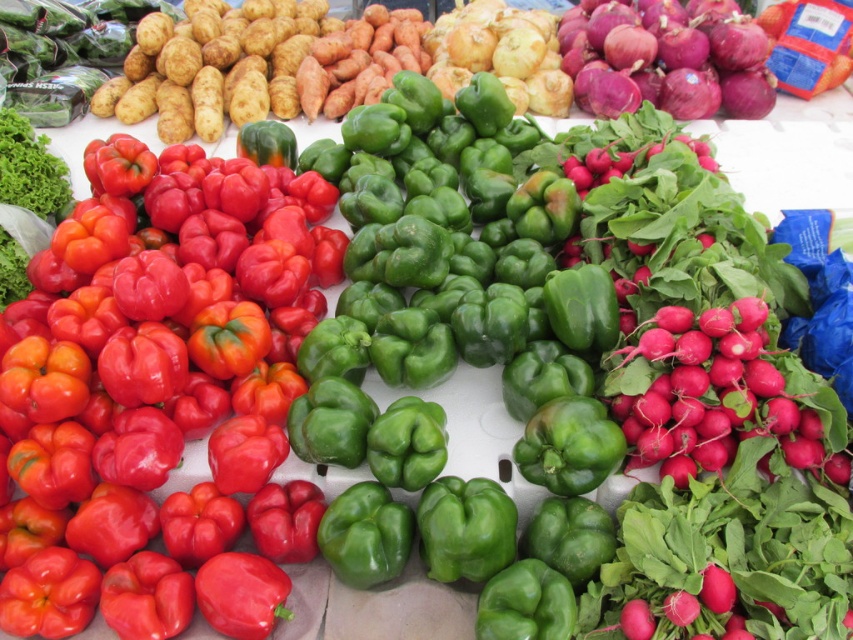
Question: Does shiny red bell pepper at left appear on the left side of purple smooth onion at upper right?

Choices:
 (A) no
 (B) yes

Answer: (B)

Question: Does shiny red bell pepper at left lie in front of purple smooth onion at upper right?

Choices:
 (A) yes
 (B) no

Answer: (A)

Question: Is shiny red bell pepper at left thinner than purple smooth onion at upper right?

Choices:
 (A) no
 (B) yes

Answer: (A)

Question: Among these points, which one is farthest from the camera?

Choices:
 (A) (764, 97)
 (B) (199, 333)

Answer: (A)

Question: Which of the following is the closest to the observer?

Choices:
 (A) purple smooth onion at upper right
 (B) shiny red bell pepper at left

Answer: (B)